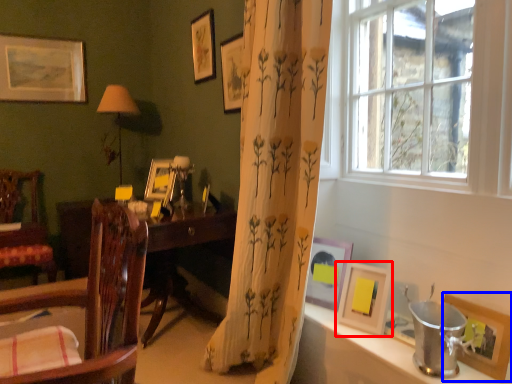
Question: Which point is closer to the camera, picture frame (highlighted by a red box) or picture frame (highlighted by a blue box)?

Choices:
 (A) picture frame
 (B) picture frame

Answer: (B)